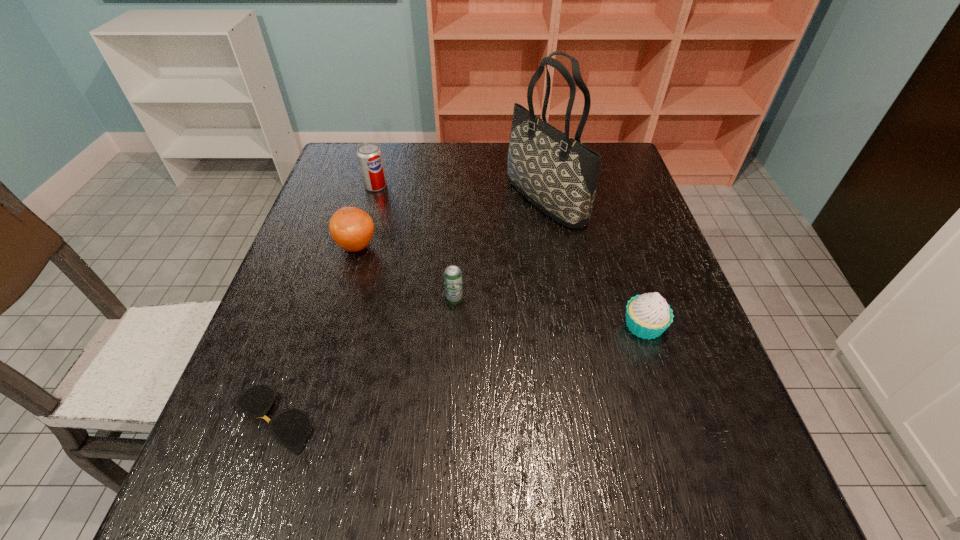
Where is `free space between the nearest object and the soda`? The height and width of the screenshot is (540, 960). free space between the nearest object and the soda is located at coordinates (323, 302).

Identify the location of free space that is in between the fourth object from left to right and the second nearest object. (549, 313).

You are a GUI agent. You are given a task and a screenshot of the screen. Output one action in this format:
    pyautogui.click(x=<x>, y=<y>)
    Task: Click on the vacant space that is in between the shortest object and the tote bag
    Image resolution: width=960 pixels, height=540 pixels.
    Given the screenshot: What is the action you would take?
    pyautogui.click(x=407, y=309)

Find the location of `vacant space that is in between the fourth object from left to right and the spectacles`. vacant space that is in between the fourth object from left to right and the spectacles is located at coordinates (362, 360).

Identify the location of vacant area that lies between the cupcake and the shortest object. (457, 373).

Find the location of a particular element. The height and width of the screenshot is (540, 960). unoccupied position between the second object from right to left and the orange is located at coordinates [x=451, y=222].

Locate an element on the screen. vacant space in between the shortest object and the rightmost object is located at coordinates (457, 373).

Where is `free area in between the tote bag and the nearest object`? The width and height of the screenshot is (960, 540). free area in between the tote bag and the nearest object is located at coordinates (407, 309).

Where is `object identified as the fourth closest to the tote bag`? object identified as the fourth closest to the tote bag is located at coordinates (369, 154).

Choose which object is the fourth nearest neighbor to the cupcake. Please provide its 2D coordinates. Your answer should be formatted as a tuple, i.e. [(x, y)], where the tuple contains the x and y coordinates of a point satisfying the conditions above.

[(291, 428)]